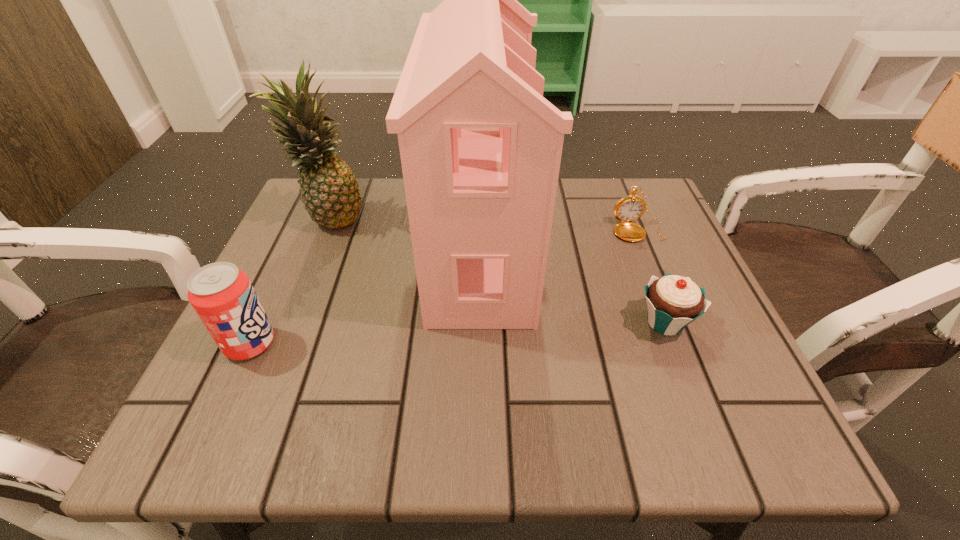
I want to click on free location located on the face of the pocket watch, so click(x=656, y=272).

Where is `dollhouse that is at the far edge`? This screenshot has height=540, width=960. dollhouse that is at the far edge is located at coordinates (480, 147).

This screenshot has width=960, height=540. Find the location of `pineapple that is at the far edge`. pineapple that is at the far edge is located at coordinates (329, 189).

This screenshot has height=540, width=960. Find the location of `pocket watch that is at the far edge`. pocket watch that is at the far edge is located at coordinates (630, 208).

Locate an element on the screen. The image size is (960, 540). pineapple that is at the left edge is located at coordinates (329, 189).

At what (x,y) coordinates should I click in order to perform the action: click on soda can that is positioned at the left edge. Please return your answer as a coordinate pair (x, y). This screenshot has height=540, width=960. Looking at the image, I should click on (222, 295).

You are a GUI agent. You are given a task and a screenshot of the screen. Output one action in this format:
    pyautogui.click(x=<x>, y=<y>)
    Task: Click on the cupcake situated at the right edge
    The height and width of the screenshot is (540, 960).
    Given the screenshot: What is the action you would take?
    pyautogui.click(x=673, y=302)

Where is `pocket watch at the right edge`? This screenshot has height=540, width=960. pocket watch at the right edge is located at coordinates (630, 208).

Locate an element on the screen. The image size is (960, 540). object that is at the far left corner is located at coordinates (329, 189).

The width and height of the screenshot is (960, 540). Find the location of `object positioned at the far right corner`. object positioned at the far right corner is located at coordinates (630, 208).